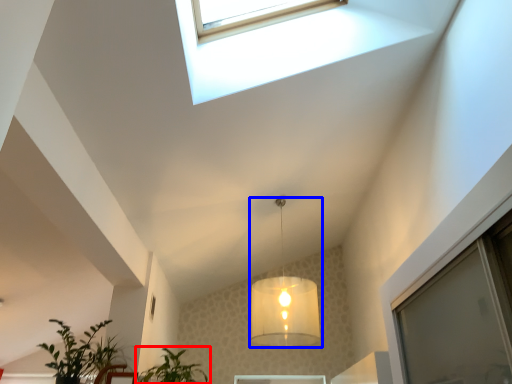
Question: Which point is closer to the camera, houseplant (highlighted by a red box) or lamp (highlighted by a blue box)?

Choices:
 (A) houseplant
 (B) lamp

Answer: (A)